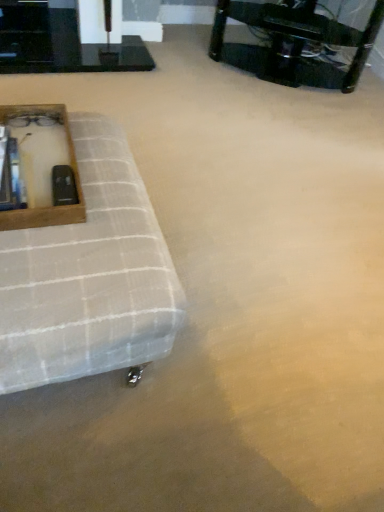
What do you see at coordinates (60, 42) in the screenshot? Image resolution: width=384 pixels, height=512 pixels. I see `black glossy table at upper left, the first table when ordered from left to right` at bounding box center [60, 42].

What do you see at coordinates (298, 42) in the screenshot?
I see `black plastic table at upper right, acting as the second table starting from the left` at bounding box center [298, 42].

Identify the location of white textured ottoman at left. The width and height of the screenshot is (384, 512). point(89,276).

Locate an element on the screen. The image size is (384, 512). wooden frame at left is located at coordinates (45, 207).

Image resolution: width=384 pixels, height=512 pixels. What are the coordinates of `black glossy table at upper left, the first table when ordered from left to right` in the screenshot? It's located at (60, 42).

Is white textured ottoman at left far away from black glossy table at upper left, the first table when ordered from left to right?

white textured ottoman at left is far away from black glossy table at upper left, the first table when ordered from left to right.

Does white textured ottoman at left have a greater height compared to black glossy table at upper left, the 2th table viewed from the right?

Yes, white textured ottoman at left is taller than black glossy table at upper left, the 2th table viewed from the right.

Does white textured ottoman at left contain black glossy table at upper left, the 2th table viewed from the right?

Actually, black glossy table at upper left, the 2th table viewed from the right, is outside white textured ottoman at left.

Are wooden frame at left and black glossy table at upper left, the first table when ordered from left to right, located far from each other?

wooden frame at left is positioned a significant distance from black glossy table at upper left, the first table when ordered from left to right.

What's the angular difference between wooden frame at left and black glossy table at upper left, the first table when ordered from left to right,'s facing directions?

The facing directions of wooden frame at left and black glossy table at upper left, the first table when ordered from left to right, are 179 degrees apart.

Can you confirm if wooden frame at left is positioned to the left of black glossy table at upper left, the first table when ordered from left to right?

No.

How much distance is there between wooden frame at left and black glossy table at upper left, the 2th table viewed from the right?

wooden frame at left and black glossy table at upper left, the 2th table viewed from the right, are 3.34 feet apart.

Considering the relative sizes of black glossy table at upper left, the 2th table viewed from the right, and black plastic table at upper right, acting as the second table starting from the left, in the image provided, is black glossy table at upper left, the 2th table viewed from the right, thinner than black plastic table at upper right, acting as the second table starting from the left,?

Yes, black glossy table at upper left, the 2th table viewed from the right, is thinner than black plastic table at upper right, acting as the second table starting from the left.

Is black glossy table at upper left, the 2th table viewed from the right, shorter than black plastic table at upper right, positioned as the first table in right-to-left order?

Yes.

Is black glossy table at upper left, the first table when ordered from left to right, surrounding black plastic table at upper right, positioned as the first table in right-to-left order?

No, black plastic table at upper right, positioned as the first table in right-to-left order, is not surrounded by black glossy table at upper left, the first table when ordered from left to right.

How much distance is there between wooden frame at left and white textured ottoman at left?

The distance of wooden frame at left from white textured ottoman at left is 6.27 inches.

Based on their positions, is wooden frame at left located to the left or right of white textured ottoman at left?

Clearly, wooden frame at left is on the left of white textured ottoman at left in the image.

Is wooden frame at left in front of or behind white textured ottoman at left in the image?

In the image, wooden frame at left appears behind white textured ottoman at left.

Which of these two, wooden frame at left or white textured ottoman at left, is wider?

Wider between the two is white textured ottoman at left.

Would you say white textured ottoman at left contains wooden frame at left?

No, white textured ottoman at left does not contain wooden frame at left.

Is white textured ottoman at left wider or thinner than wooden frame at left?

In the image, white textured ottoman at left appears to be wider than wooden frame at left.

What's the angular difference between white textured ottoman at left and wooden frame at left's facing directions?

There is a 1.64-degree angle between the facing directions of white textured ottoman at left and wooden frame at left.

Is white textured ottoman at left in front of or behind wooden frame at left in the image?

white textured ottoman at left is positioned closer to the viewer than wooden frame at left.

Could you tell me if black plastic table at upper right, positioned as the first table in right-to-left order, is facing black glossy table at upper left, the first table when ordered from left to right?

No, black plastic table at upper right, positioned as the first table in right-to-left order, is not facing towards black glossy table at upper left, the first table when ordered from left to right.

Which point is more forward, (265, 19) or (96, 67)?

The point (96, 67) is in front.

Is the depth of black plastic table at upper right, acting as the second table starting from the left, greater than that of black glossy table at upper left, the first table when ordered from left to right?

No, black plastic table at upper right, acting as the second table starting from the left, is in front of black glossy table at upper left, the first table when ordered from left to right.

Considering the sizes of objects black plastic table at upper right, acting as the second table starting from the left, and black glossy table at upper left, the 2th table viewed from the right, in the image provided, who is thinner, black plastic table at upper right, acting as the second table starting from the left, or black glossy table at upper left, the 2th table viewed from the right,?

black glossy table at upper left, the 2th table viewed from the right, is thinner.

In the image, is wooden frame at left positioned in front of or behind black plastic table at upper right, positioned as the first table in right-to-left order?

wooden frame at left is positioned closer to the viewer than black plastic table at upper right, positioned as the first table in right-to-left order.

Could black plastic table at upper right, acting as the second table starting from the left, be considered to be inside wooden frame at left?

Actually, black plastic table at upper right, acting as the second table starting from the left, is outside wooden frame at left.

Can you tell me how much wooden frame at left and black plastic table at upper right, positioned as the first table in right-to-left order, differ in facing direction?

The angular difference between wooden frame at left and black plastic table at upper right, positioned as the first table in right-to-left order, is 147 degrees.

Is wooden frame at left facing away from black plastic table at upper right, acting as the second table starting from the left?

No, wooden frame at left is not facing the opposite direction of black plastic table at upper right, acting as the second table starting from the left.

Image resolution: width=384 pixels, height=512 pixels. Find the location of `furniture below the black glossy table at upper left, the first table when ordered from left to right (from the image's perspective)`. furniture below the black glossy table at upper left, the first table when ordered from left to right (from the image's perspective) is located at coordinates coord(89,276).

Where is `vanity on the right of the black glossy table at upper left, the first table when ordered from left to right`? vanity on the right of the black glossy table at upper left, the first table when ordered from left to right is located at coordinates (45, 207).

Based on their spatial positions, is black plastic table at upper right, positioned as the first table in right-to-left order, or black glossy table at upper left, the 2th table viewed from the right, closer to wooden frame at left?

black glossy table at upper left, the 2th table viewed from the right.

Based on the photo, based on their spatial positions, is black plastic table at upper right, positioned as the first table in right-to-left order, or wooden frame at left further from white textured ottoman at left?

Among the two, black plastic table at upper right, positioned as the first table in right-to-left order, is located further to white textured ottoman at left.

Considering their positions, is white textured ottoman at left positioned further to black plastic table at upper right, acting as the second table starting from the left, than black glossy table at upper left, the first table when ordered from left to right?

white textured ottoman at left is further to black plastic table at upper right, acting as the second table starting from the left.

Based on their spatial positions, is wooden frame at left or black plastic table at upper right, acting as the second table starting from the left, closer to white textured ottoman at left?

wooden frame at left lies closer to white textured ottoman at left than the other object.

Based on their spatial positions, is wooden frame at left or white textured ottoman at left closer to black glossy table at upper left, the 2th table viewed from the right?

wooden frame at left lies closer to black glossy table at upper left, the 2th table viewed from the right, than the other object.

Estimate the real-world distances between objects in this image. Which object is further from white textured ottoman at left, wooden frame at left or black glossy table at upper left, the first table when ordered from left to right?

Among the two, black glossy table at upper left, the first table when ordered from left to right, is located further to white textured ottoman at left.

Considering their positions, is black glossy table at upper left, the first table when ordered from left to right, positioned closer to wooden frame at left than black plastic table at upper right, positioned as the first table in right-to-left order?

The object closer to wooden frame at left is black glossy table at upper left, the first table when ordered from left to right.

From the image, which object appears to be farther from wooden frame at left, white textured ottoman at left or black plastic table at upper right, acting as the second table starting from the left?

black plastic table at upper right, acting as the second table starting from the left, is further to wooden frame at left.

Find the location of `table between white textured ottoman at left and black glossy table at upper left, the first table when ordered from left to right, from front to back`. table between white textured ottoman at left and black glossy table at upper left, the first table when ordered from left to right, from front to back is located at coordinates pyautogui.click(x=298, y=42).

The width and height of the screenshot is (384, 512). What are the coordinates of `vanity between white textured ottoman at left and black glossy table at upper left, the first table when ordered from left to right, from front to back` in the screenshot? It's located at (45, 207).

You are a GUI agent. You are given a task and a screenshot of the screen. Output one action in this format:
    pyautogui.click(x=<x>, y=<y>)
    Task: Click on the table between wooden frame at left and black glossy table at upper left, the 2th table viewed from the right, in the front-back direction
    
    Given the screenshot: What is the action you would take?
    pyautogui.click(x=298, y=42)

The image size is (384, 512). What are the coordinates of `vanity between white textured ottoman at left and black plastic table at upper right, positioned as the first table in right-to-left order, in the front-back direction` in the screenshot? It's located at (45, 207).